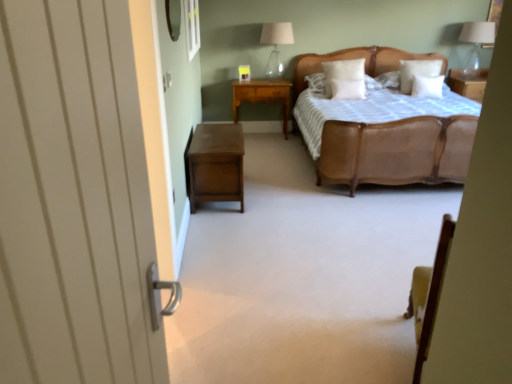
Question: Is point (350, 92) closer or farther from the camera than point (269, 43)?

Choices:
 (A) closer
 (B) farther

Answer: (A)

Question: From a real-world perspective, is white soft pillow at center, the second pillow when ordered from left to right, physically located above or below clear glass table lamp at upper center, which appears as the 1th table lamp when viewed from the left?

Choices:
 (A) below
 (B) above

Answer: (A)

Question: Estimate the real-world distances between objects in this image. Which object is farther from the light brown wood nightstand at center, which ranks as the 1th nightstand in back-to-front order?

Choices:
 (A) white soft pillow at upper center, which appears as the second pillow when viewed from the right
 (B) brown wood nightstand at lower left, acting as the 2th nightstand starting from the back
 (C) white wooden door at left
 (D) white soft pillow at center, which is the fourth pillow in right-to-left order
 (E) transparent glass table lamp at upper right, which is the second table lamp from left to right

Answer: (C)

Question: Considering the real-world distances, which object is closest to the transparent glass table lamp at upper right, the first table lamp in the right-to-left sequence?

Choices:
 (A) brown wood nightstand at lower left, the first nightstand in the front-to-back sequence
 (B) white soft pillow at center, which ranks as the 1th pillow in left-to-right order
 (C) white soft pillow at center, which appears as the third pillow when viewed from the right
 (D) white soft pillow at upper center, which appears as the second pillow when viewed from the right
 (E) white wooden door at left

Answer: (D)